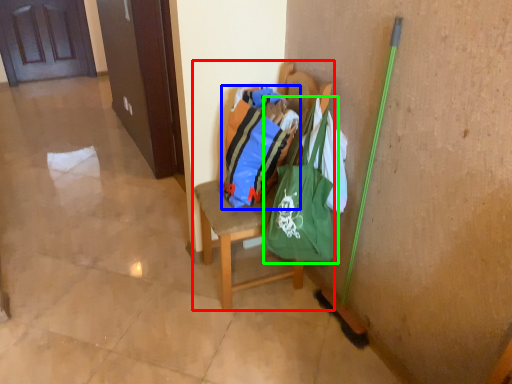
Question: Which is nearer to the chair (highlighted by a red box)? shopping bag (highlighted by a blue box) or shoulder bag (highlighted by a green box).

Choices:
 (A) shopping bag
 (B) shoulder bag

Answer: (A)